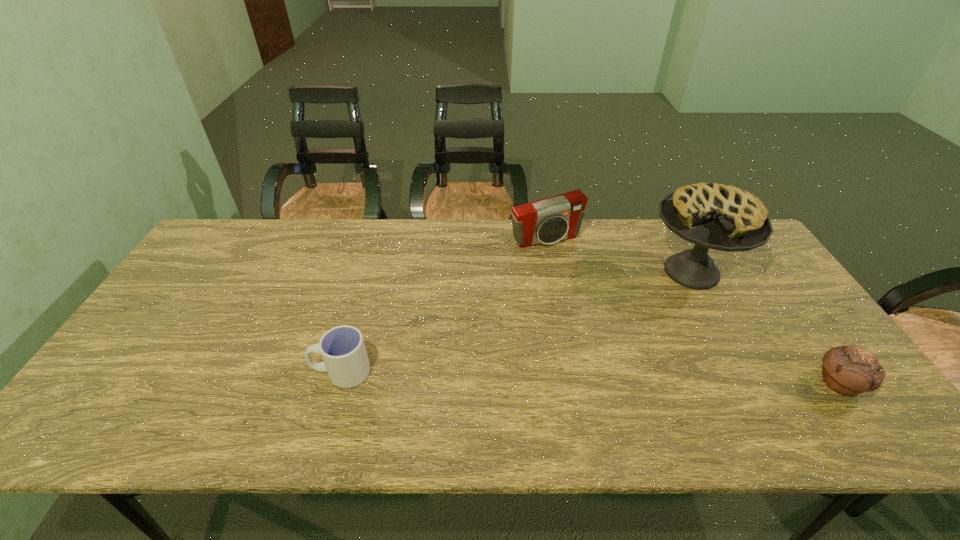
Find the location of a particular element. The image size is (960, 540). vacant space located 0.200m on the cut side of the tallest object is located at coordinates click(x=619, y=324).

The image size is (960, 540). I want to click on vacant space situated 0.270m on the cut side of the tallest object, so click(602, 336).

The width and height of the screenshot is (960, 540). I want to click on vacant space located on the cut side of the tallest object, so click(x=602, y=336).

This screenshot has width=960, height=540. In order to click on free space located 0.400m on the front-facing side of the camera in this screenshot , I will do `click(618, 341)`.

What are the coordinates of `free location located 0.370m on the front-facing side of the camera` in the screenshot? It's located at (612, 333).

Locate an element on the screen. vacant space located on the front-facing side of the camera is located at coordinates (604, 320).

Find the location of a particular element. Image resolution: width=960 pixels, height=540 pixels. pie at the far edge is located at coordinates (714, 216).

You are a GUI agent. You are given a task and a screenshot of the screen. Output one action in this format:
    pyautogui.click(x=<x>, y=<y>)
    Task: Click on the camera at the far edge
    The image size is (960, 540).
    Given the screenshot: What is the action you would take?
    pyautogui.click(x=547, y=221)

The width and height of the screenshot is (960, 540). Find the location of `cup that is positioned at the near edge`. cup that is positioned at the near edge is located at coordinates (342, 348).

Where is `muffin that is at the near edge`? muffin that is at the near edge is located at coordinates (848, 370).